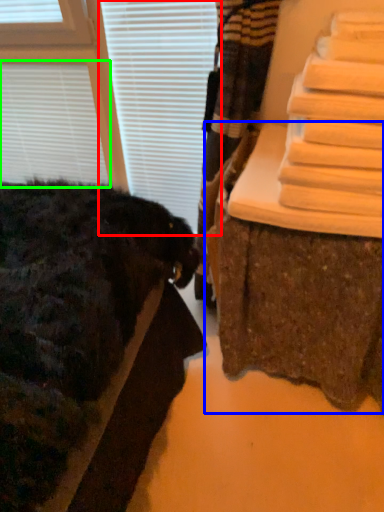
Question: Estimate the real-world distances between objects in this image. Which object is farther from blind (highlighted by a red box), furniture (highlighted by a blue box) or blind (highlighted by a green box)?

Choices:
 (A) furniture
 (B) blind

Answer: (A)